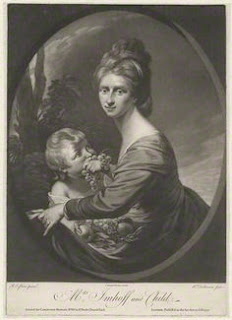
Where is `picture of a painting`? picture of a painting is located at coordinates (136, 157).